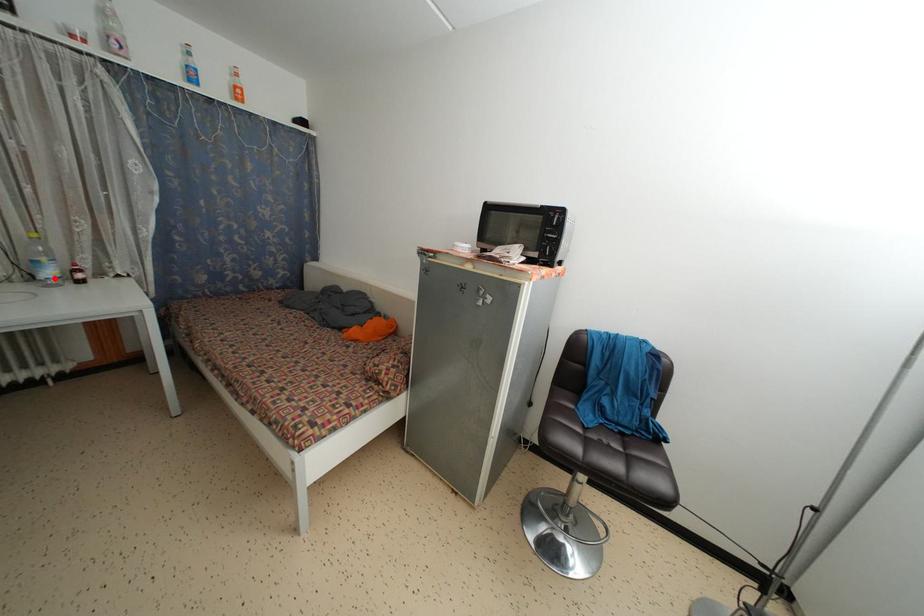
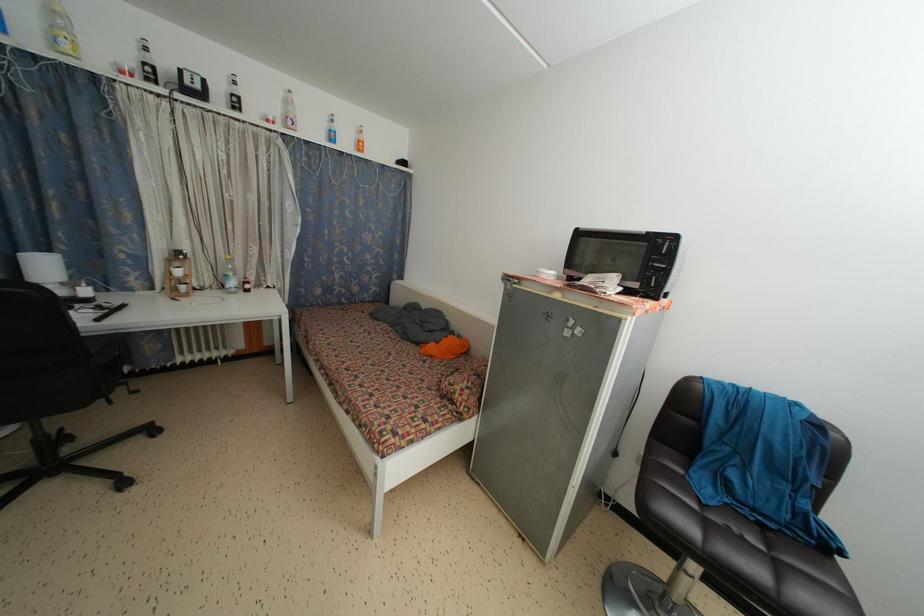
Question: I am providing you with two images of the same scene from different viewpoints. A red point is marked on the first image. Is the red point's position out of view in image 2?

Choices:
 (A) Yes
 (B) No

Answer: (B)